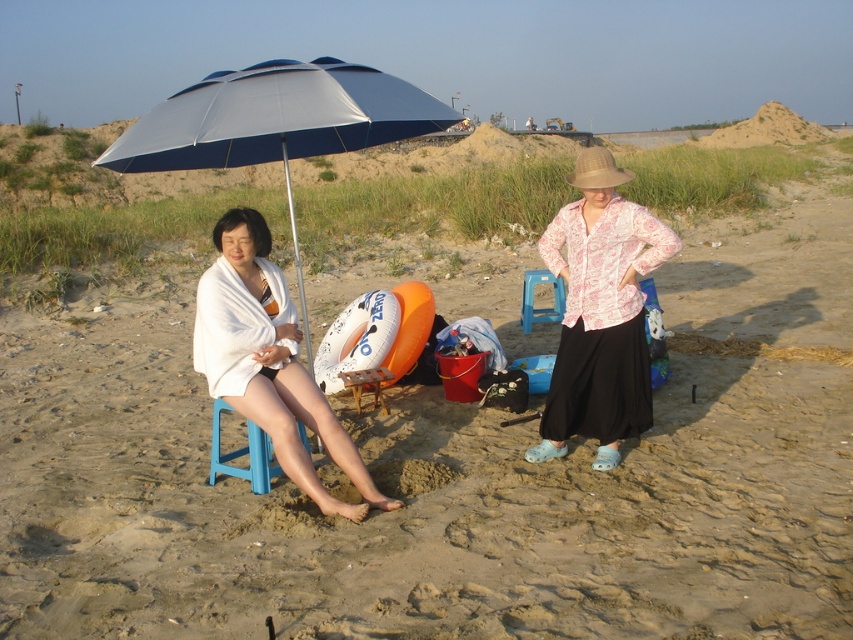
You are a photographer standing at the beach and want to take a photo of the white towel at left and the blue plastic stool at lower left. Which object is positioned closer to your camera?

The white towel at left is closer to the viewer than the blue plastic stool at lower left, so it will appear closer in the photo.

You are a photographer trying to capture a candid shot of both the blue plastic stool at lower left and the blue plastic beach chair at center. Since you want to include both in the frame, can you determine which one is positioned lower in the image?

The blue plastic stool at lower left is located below the blue plastic beach chair at center, so the blue plastic stool at lower left is positioned lower in the image.

You are a lifeguard on duty and need to quickly move from the blue plastic stool at lower left to the blue plastic beach chair at center. Can you reach the chair within 5 seconds if you walk at a normal pace?

The distance between the blue plastic stool at lower left and the blue plastic beach chair at center is 4.12 meters. Walking at a normal pace of about 1.4 meters per second, it would take approximately 2.94 seconds to cover this distance. Therefore, you can reach the chair within 5 seconds.